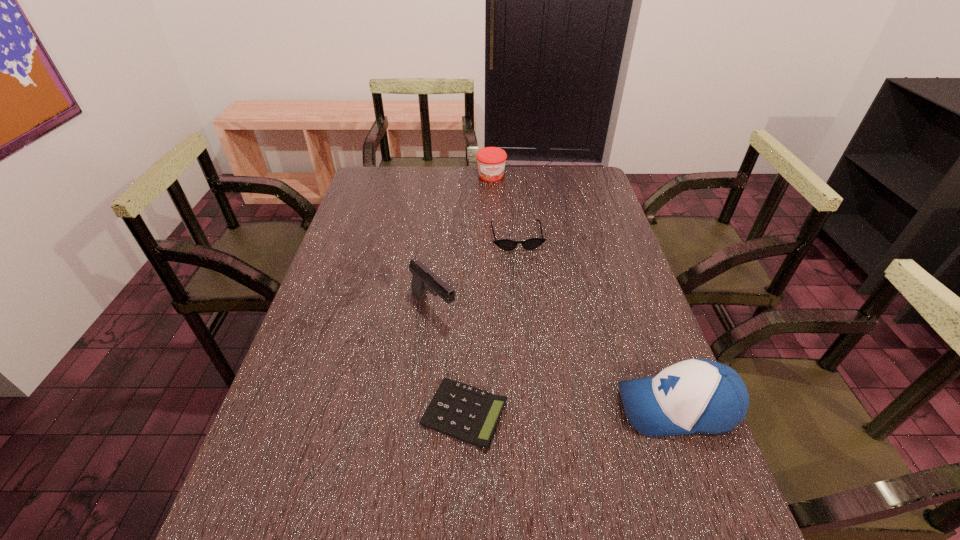
Locate an element on the screen. vacant space on the desktop that is between the shortest object and the baseball cap and is positioned on the front-facing side of the fourth tallest object is located at coordinates (554, 411).

You are a GUI agent. You are given a task and a screenshot of the screen. Output one action in this format:
    pyautogui.click(x=<x>, y=<y>)
    Task: Click on the free spot on the desktop that is between the shortest object and the baseball cap and is positioned aim along the barrel of the third farthest object
    This screenshot has height=540, width=960.
    Given the screenshot: What is the action you would take?
    pyautogui.click(x=544, y=411)

Identify the location of free space on the desktop that is between the calculator and the rightmost object and is positioned on the label side of the third shortest object. (577, 410).